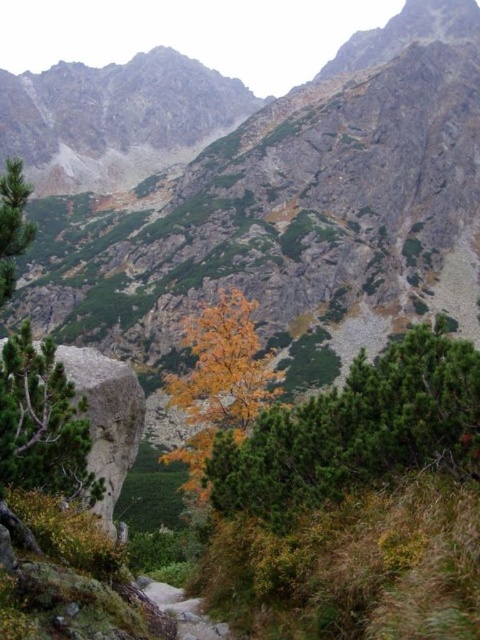
You are a hiker standing at the base of the mountain. You see two points marked on the map. One is at point coordinates point (x=304, y=428) and the other is at point coordinates point (x=12, y=451). Which point is closer to your current position?

Point (x=304, y=428) is closer to your current position because it is further to the viewer than point (x=12, y=451).